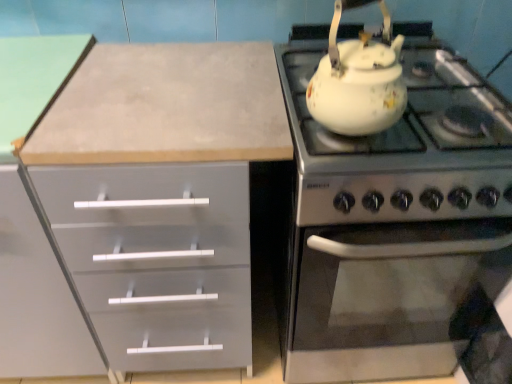
Question: From the image's perspective, is white glossy kettle at upper right above or below white glossy teapot at upper right?

Choices:
 (A) above
 (B) below

Answer: (B)

Question: From a real-world perspective, is white glossy kettle at upper right physically located above or below white glossy teapot at upper right?

Choices:
 (A) above
 (B) below

Answer: (B)

Question: Relative to white glossy teapot at upper right, is white glossy kettle at upper right in front or behind?

Choices:
 (A) behind
 (B) front

Answer: (A)

Question: From a real-world perspective, relative to white glossy kettle at upper right, is white glossy teapot at upper right vertically above or below?

Choices:
 (A) above
 (B) below

Answer: (A)

Question: Considering the positions of white glossy teapot at upper right and white glossy kettle at upper right in the image, is white glossy teapot at upper right wider or thinner than white glossy kettle at upper right?

Choices:
 (A) wide
 (B) thin

Answer: (B)

Question: From their relative heights in the image, would you say white glossy teapot at upper right is taller or shorter than white glossy kettle at upper right?

Choices:
 (A) tall
 (B) short

Answer: (B)

Question: Considering their positions, is white glossy teapot at upper right located in front of or behind white glossy kettle at upper right?

Choices:
 (A) front
 (B) behind

Answer: (A)